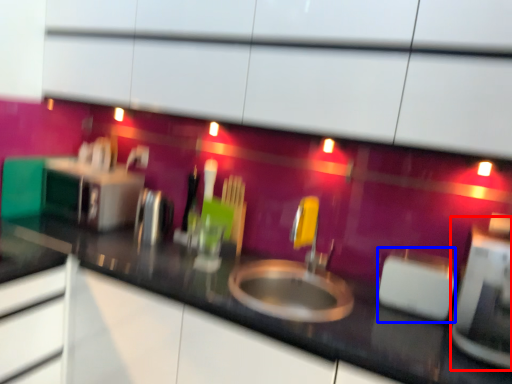
Question: Which object is closer to the camera taking this photo, appliance (highlighted by a red box) or appliance (highlighted by a blue box)?

Choices:
 (A) appliance
 (B) appliance

Answer: (A)